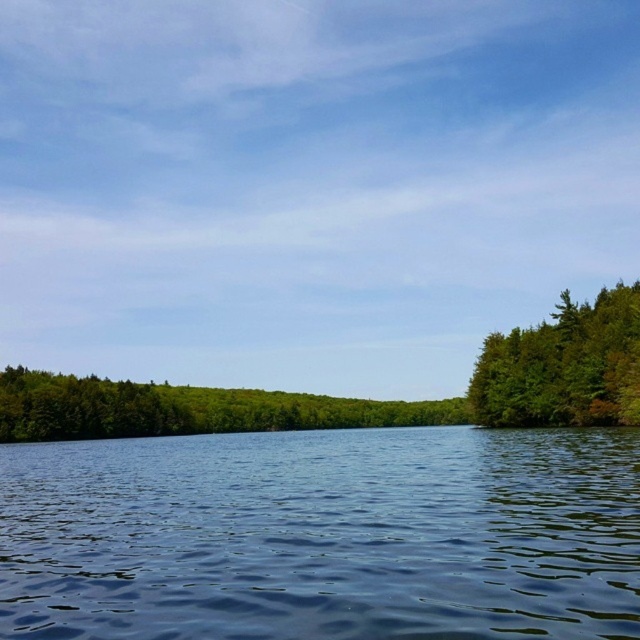
Measure the distance between green leafy trees at center and camera.

The distance of green leafy trees at center from camera is 143.85 meters.

Is green leafy trees at center behind green matte tree at right?

Yes, it is.

Which is in front, point (88, 432) or point (580, 388)?

Point (580, 388)

Image resolution: width=640 pixels, height=640 pixels. In order to click on green leafy trees at center in this screenshot , I will do `click(186, 408)`.

Is blue liquid water at center to the right of green leafy trees at center from the viewer's perspective?

Correct, you'll find blue liquid water at center to the right of green leafy trees at center.

Can you confirm if blue liquid water at center is smaller than green leafy trees at center?

Yes, blue liquid water at center is smaller than green leafy trees at center.

Who is more forward, (308, 566) or (116, 420)?

Point (308, 566)

You are a GUI agent. You are given a task and a screenshot of the screen. Output one action in this format:
    pyautogui.click(x=<x>, y=<y>)
    Task: Click on the blue liquid water at center
    
    Given the screenshot: What is the action you would take?
    pyautogui.click(x=323, y=536)

Is blue liquid water at center positioned behind green matte tree at right?

That is False.

Can you confirm if blue liquid water at center is positioned to the right of green matte tree at right?

No, blue liquid water at center is not to the right of green matte tree at right.

The image size is (640, 640). Identify the location of blue liquid water at center. (323, 536).